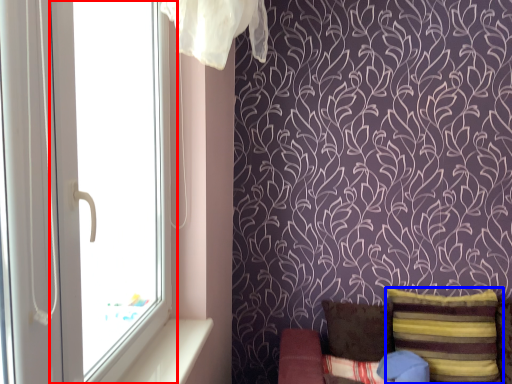
Question: Which object is further to the camera taking this photo, window (highlighted by a red box) or pillow (highlighted by a blue box)?

Choices:
 (A) window
 (B) pillow

Answer: (B)